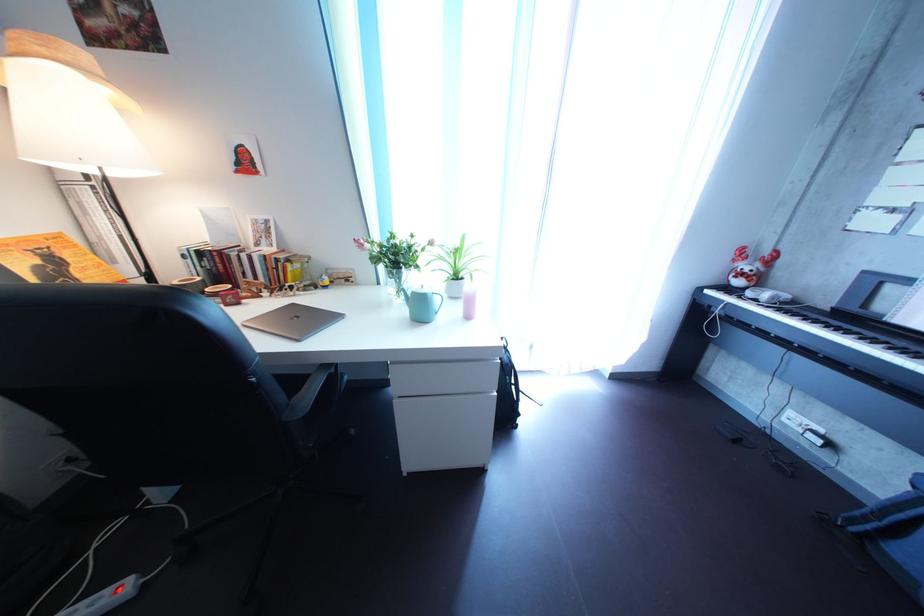
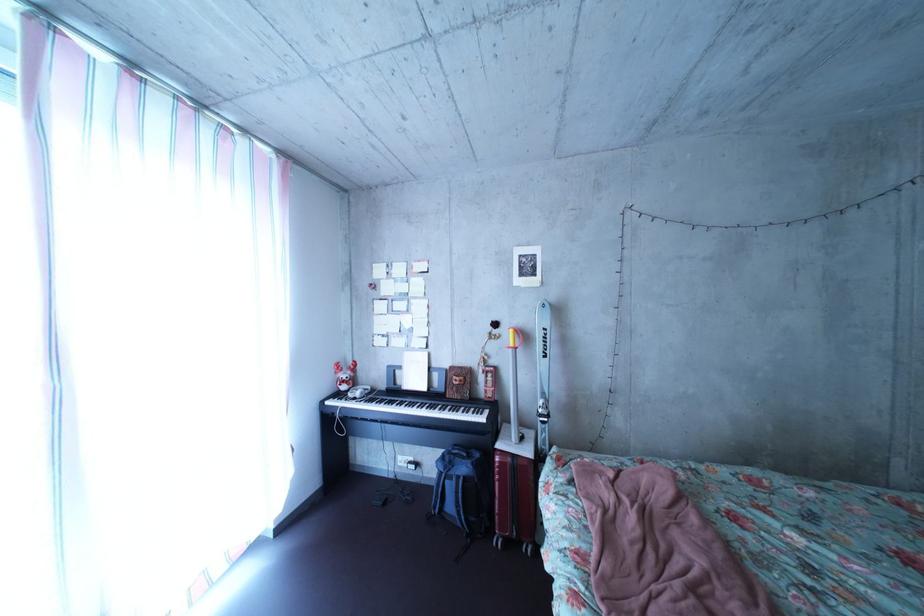
In the second image, find the point that corresponds to pixel 752 291 in the first image.

(358, 395)